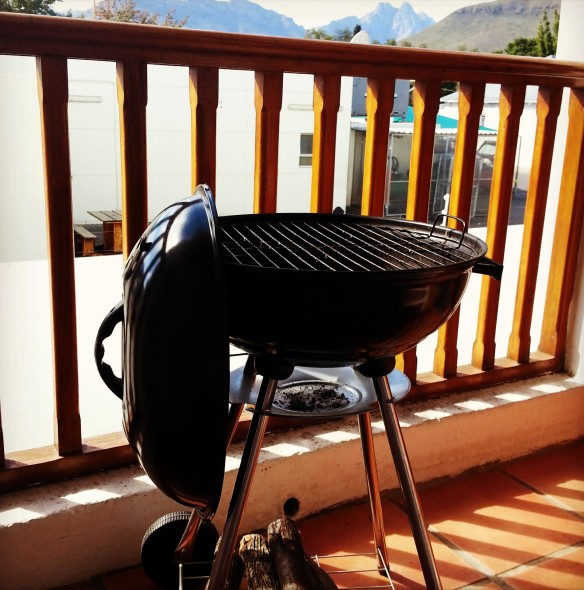
At what (x,y) coordinates should I click in order to perform the action: click on wooden railing. Please return your answer as a coordinate pair (x, y). This screenshot has height=590, width=584. Looking at the image, I should click on (485, 382).